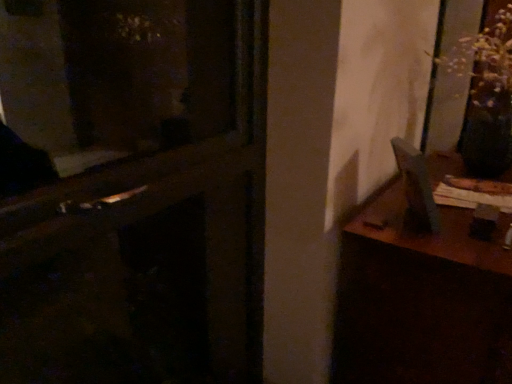
Question: In terms of width, does wooden table at right look wider or thinner when compared to wooden door at center?

Choices:
 (A) wide
 (B) thin

Answer: (A)

Question: Is wooden table at right in front of or behind wooden door at center in the image?

Choices:
 (A) behind
 (B) front

Answer: (A)

Question: From the image's perspective, is wooden table at right above or below wooden door at center?

Choices:
 (A) below
 (B) above

Answer: (A)

Question: Visually, is wooden door at center positioned to the left or to the right of wooden table at right?

Choices:
 (A) left
 (B) right

Answer: (A)

Question: Considering the positions of wooden door at center and wooden table at right in the image, is wooden door at center taller or shorter than wooden table at right?

Choices:
 (A) tall
 (B) short

Answer: (A)

Question: Does point (33, 94) appear closer or farther from the camera than point (367, 226)?

Choices:
 (A) farther
 (B) closer

Answer: (A)

Question: From a real-world perspective, is wooden door at center above or below wooden table at right?

Choices:
 (A) above
 (B) below

Answer: (A)